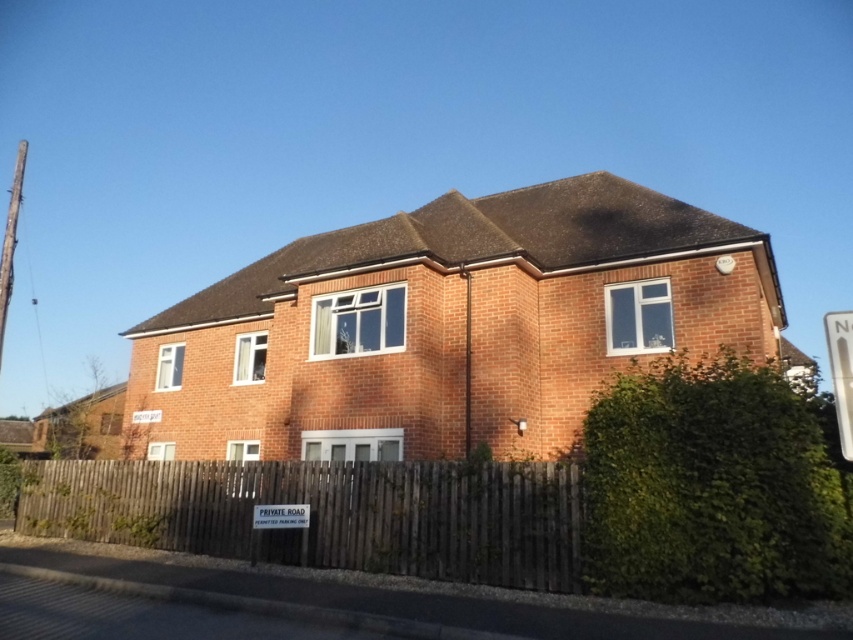
Question: Does green leafy hedge at right appear under white plastic sign at lower center?

Choices:
 (A) no
 (B) yes

Answer: (A)

Question: Can you confirm if green leafy hedge at right is positioned above brown wooden fence at lower center?

Choices:
 (A) no
 (B) yes

Answer: (B)

Question: Among these objects, which one is nearest to the camera?

Choices:
 (A) white plastic sign at upper right
 (B) white plastic sign at lower center
 (C) green leafy hedge at right
 (D) brown wooden fence at lower center

Answer: (A)

Question: Based on their relative distances, which object is farther from the brown wooden fence at lower center?

Choices:
 (A) green leafy hedge at right
 (B) white plastic sign at lower center
 (C) white plastic sign at upper right

Answer: (C)

Question: Which point is farther to the camera?

Choices:
 (A) brown wooden fence at lower center
 (B) white plastic sign at upper right
 (C) white plastic sign at lower center

Answer: (C)

Question: Can you confirm if brown wooden fence at lower center is positioned above white plastic sign at lower center?

Choices:
 (A) yes
 (B) no

Answer: (B)